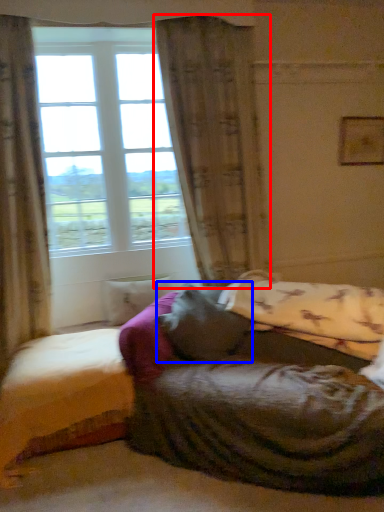
Question: Which of the following is the closest to the observer, curtain (highlighted by a red box) or pillow (highlighted by a blue box)?

Choices:
 (A) curtain
 (B) pillow

Answer: (B)